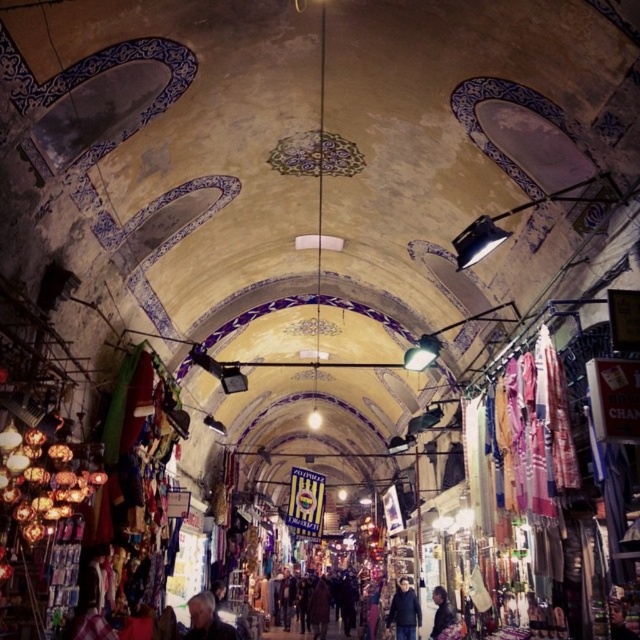
Question: Is gray fabric jacket at lower center behind dark brown leather jacket at lower right?

Choices:
 (A) yes
 (B) no

Answer: (B)

Question: Which of the following is the farthest from the observer?

Choices:
 (A) dark brown leather jacket at lower right
 (B) gray fabric jacket at lower center
 (C) dark blue jacket at center

Answer: (C)

Question: Is the position of gray fabric jacket at lower center less distant than that of dark blue jacket at center?

Choices:
 (A) yes
 (B) no

Answer: (A)

Question: Which object is the closest to the dark blue jacket at center?

Choices:
 (A) dark brown leather jacket at lower right
 (B) gray fabric jacket at lower center

Answer: (A)

Question: Which of these objects is positioned closest to the gray fabric jacket at lower center?

Choices:
 (A) dark blue jacket at center
 (B) dark brown leather jacket at lower right

Answer: (B)

Question: Can you confirm if dark blue jacket at center is wider than dark brown leather jacket at lower right?

Choices:
 (A) yes
 (B) no

Answer: (A)